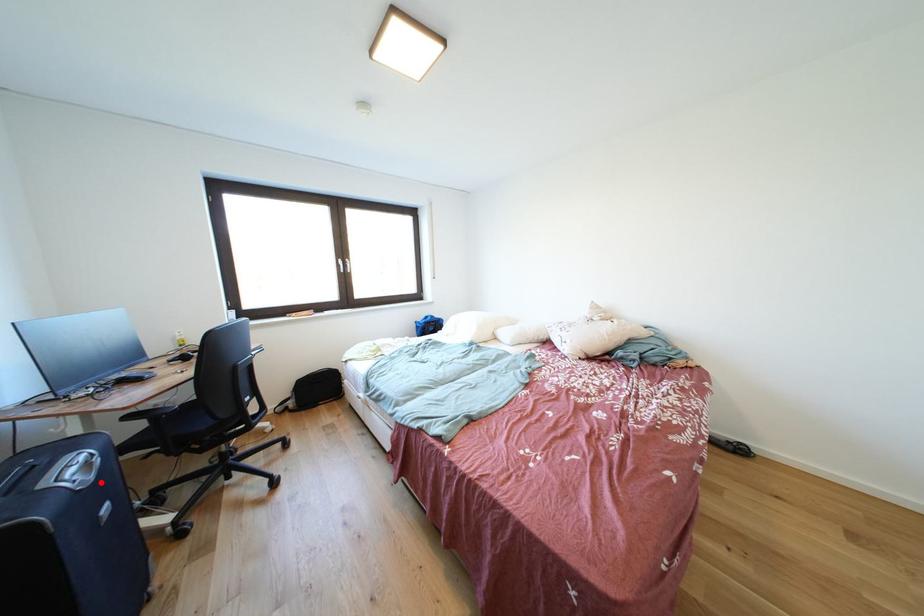
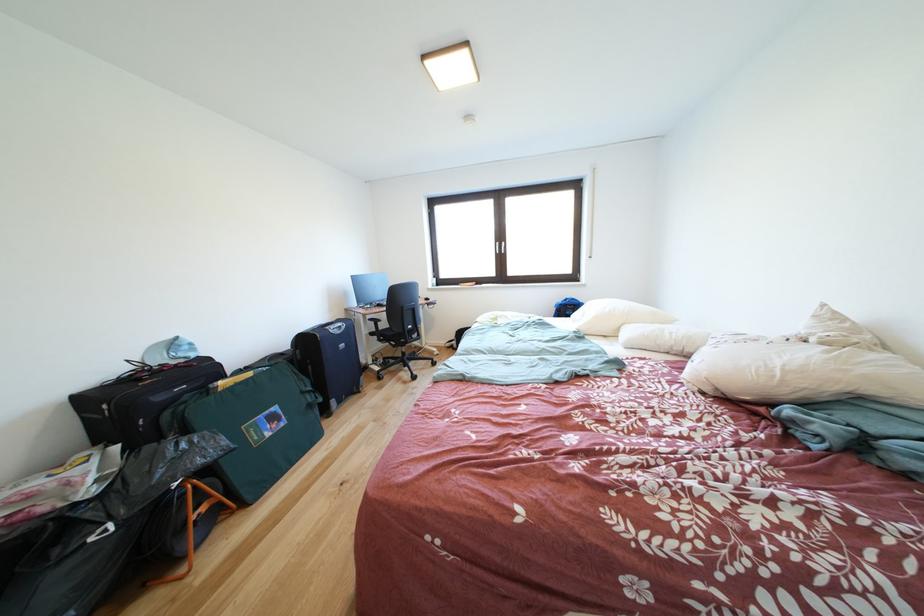
In the second image, find the point that corresponds to the highlighted location in the first image.

(347, 337)